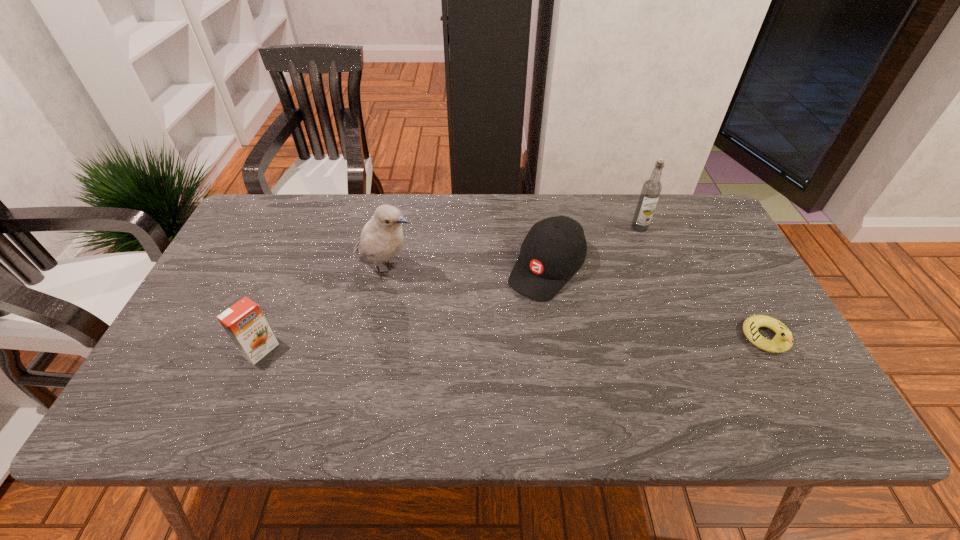
Identify the location of vacant area that lies between the vodka and the leftmost object. This screenshot has height=540, width=960. (450, 289).

Identify the location of object that stands as the third closest to the leftmost object. (651, 189).

Locate which object is the third closest to the leftmost object. Please provide its 2D coordinates. Your answer should be formatted as a tuple, i.e. [(x, y)], where the tuple contains the x and y coordinates of a point satisfying the conditions above.

[(651, 189)]

Where is `vacant space that satisfies the following two spatial constraints: 1. on the back side of the fourth object from right to left; 2. on the left side of the farthest object`? vacant space that satisfies the following two spatial constraints: 1. on the back side of the fourth object from right to left; 2. on the left side of the farthest object is located at coordinates (396, 227).

Identify the location of vacant space that satisfies the following two spatial constraints: 1. on the back side of the leftmost object; 2. on the right side of the vodka. The width and height of the screenshot is (960, 540). (311, 227).

Locate an element on the screen. The image size is (960, 540). free location that satisfies the following two spatial constraints: 1. on the back side of the leftmost object; 2. on the right side of the fourth object from left to right is located at coordinates (311, 227).

Where is `free space that satisfies the following two spatial constraints: 1. on the back side of the third object from right to left; 2. on the left side of the second object from left to right`? The image size is (960, 540). free space that satisfies the following two spatial constraints: 1. on the back side of the third object from right to left; 2. on the left side of the second object from left to right is located at coordinates (387, 269).